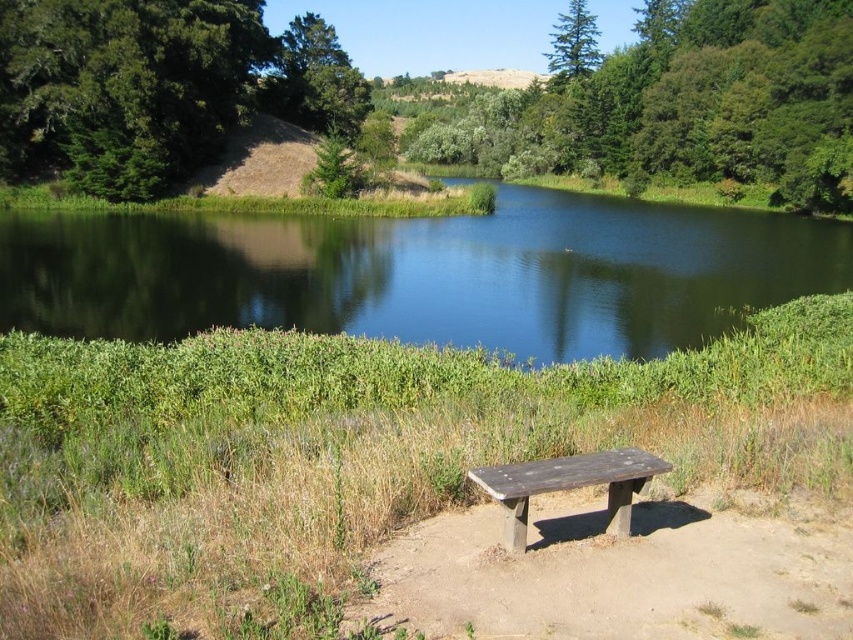
Question: Which point is farther to the camera?

Choices:
 (A) green leafy tree at upper center
 (B) wooden bench at center

Answer: (A)

Question: Does green leafy tree at upper center have a smaller size compared to green leafy tree at upper left?

Choices:
 (A) yes
 (B) no

Answer: (B)

Question: Which point is farther to the camera?

Choices:
 (A) (x=35, y=104)
 (B) (x=668, y=83)
 (C) (x=547, y=60)

Answer: (C)

Question: Considering the real-world distances, which object is farthest from the green smooth water at center?

Choices:
 (A) green matte tree at upper center
 (B) green leafy tree at upper center
 (C) wooden bench at center

Answer: (A)

Question: Can you confirm if green leafy tree at upper left is positioned above green matte tree at upper center?

Choices:
 (A) no
 (B) yes

Answer: (A)

Question: Where is green leafy tree at upper left located in relation to wooden bench at center in the image?

Choices:
 (A) below
 (B) above

Answer: (B)